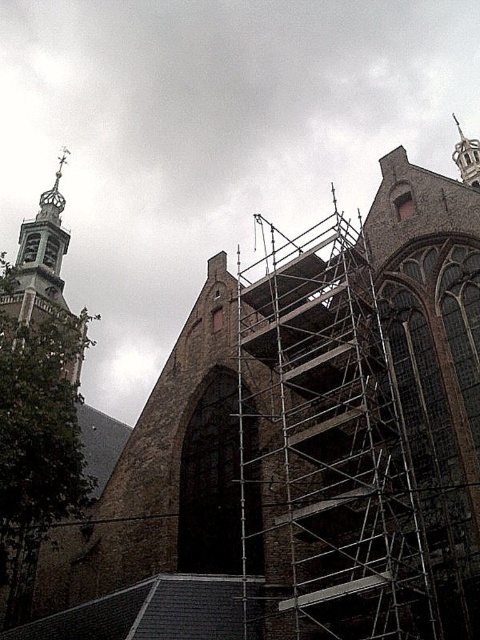
Question: Which object appears closest to the camera in this image?

Choices:
 (A) silver metallic scaffolding at center
 (B) gold ornate tower at upper left

Answer: (A)

Question: Among these points, which one is farthest from the camera?

Choices:
 (A) [x=38, y=256]
 (B) [x=368, y=588]

Answer: (A)

Question: Does silver metallic scaffolding at center lie behind gold ornate tower at upper left?

Choices:
 (A) yes
 (B) no

Answer: (B)

Question: Is silver metallic scaffolding at center behind gold ornate tower at upper left?

Choices:
 (A) yes
 (B) no

Answer: (B)

Question: Which point is farther to the camera?

Choices:
 (A) silver metallic scaffolding at center
 (B) gold ornate tower at upper left

Answer: (B)

Question: Can you confirm if silver metallic scaffolding at center is positioned below gold ornate tower at upper left?

Choices:
 (A) no
 (B) yes

Answer: (B)